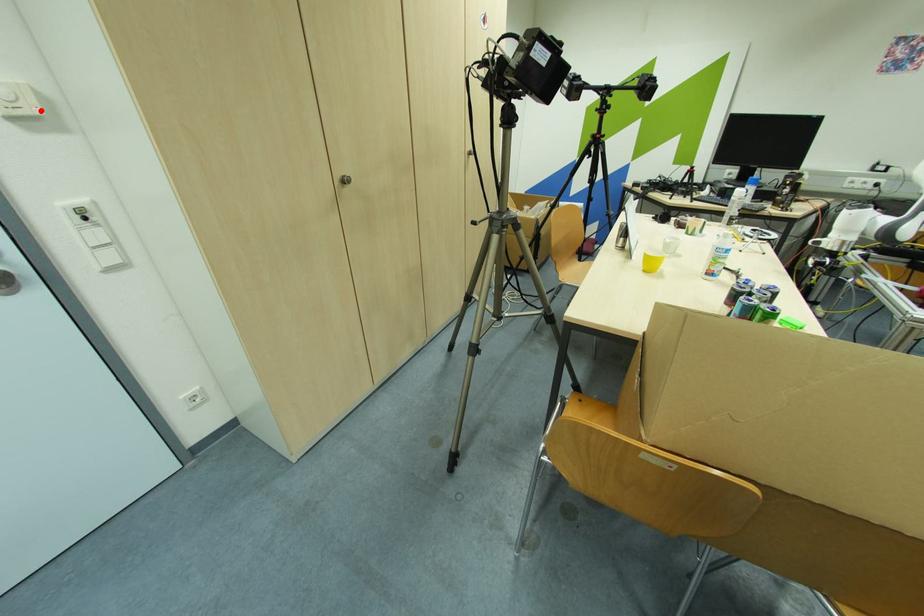
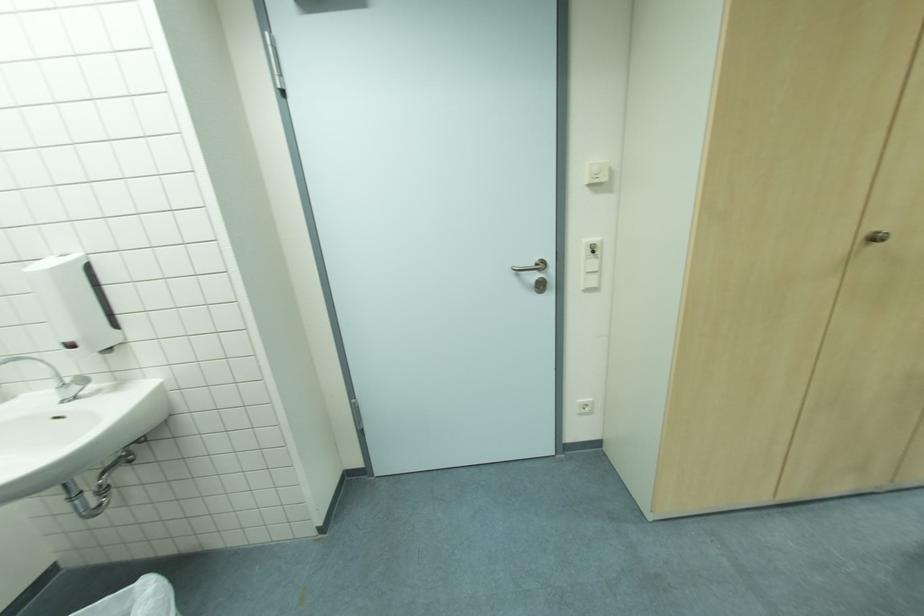
In the second image, find the point that corresponds to the highlighted location in the first image.

(608, 179)